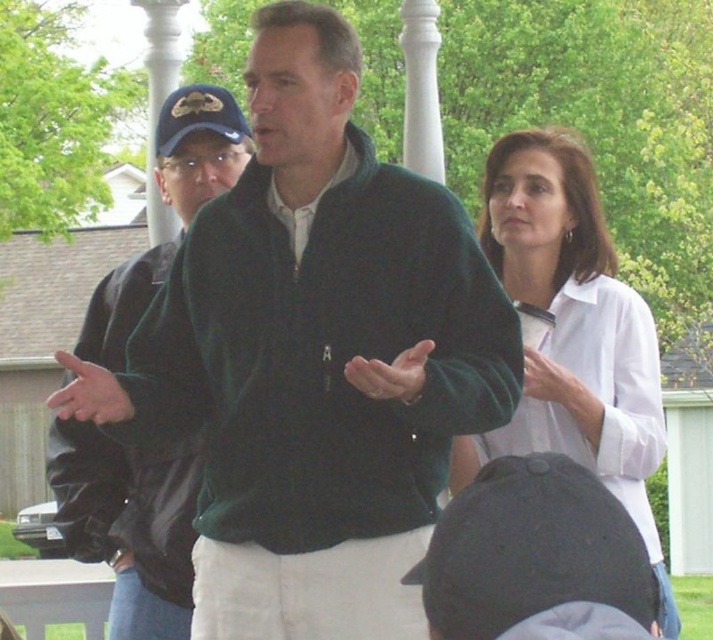
Question: Does white smooth blouse at upper right lie in front of green matte jacket at left?

Choices:
 (A) yes
 (B) no

Answer: (A)

Question: Is green fleece jacket at center wider than green matte jacket at left?

Choices:
 (A) no
 (B) yes

Answer: (B)

Question: Estimate the real-world distances between objects in this image. Which object is closer to the green fleece jacket at center?

Choices:
 (A) green matte jacket at left
 (B) white smooth blouse at upper right

Answer: (B)

Question: Which point is farther from the camera taking this photo?

Choices:
 (A) (612, 333)
 (B) (101, 504)

Answer: (A)

Question: Is green fleece jacket at center positioned at the back of green matte jacket at left?

Choices:
 (A) yes
 (B) no

Answer: (B)

Question: Among these points, which one is nearest to the camera?

Choices:
 (A) (175, 90)
 (B) (540, 280)

Answer: (B)